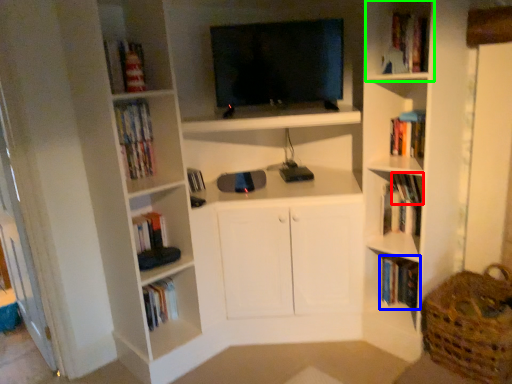
Question: Which object is positioned farthest from book (highlighted by a red box)? Select from book (highlighted by a blue box) and cabinet (highlighted by a green box).

Choices:
 (A) book
 (B) cabinet

Answer: (B)